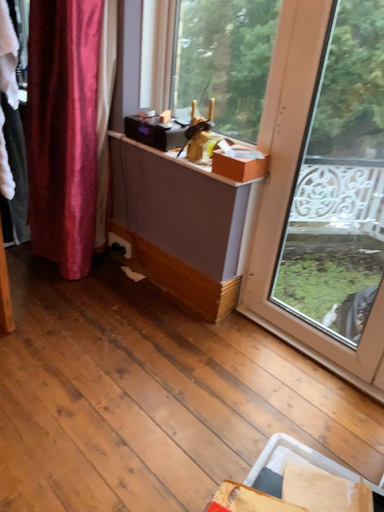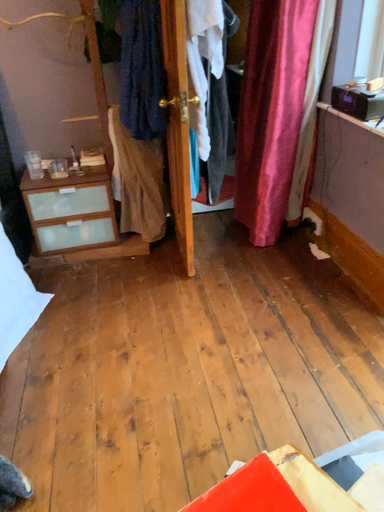
Question: Which way did the camera rotate in the video?

Choices:
 (A) rotated left
 (B) rotated right

Answer: (A)